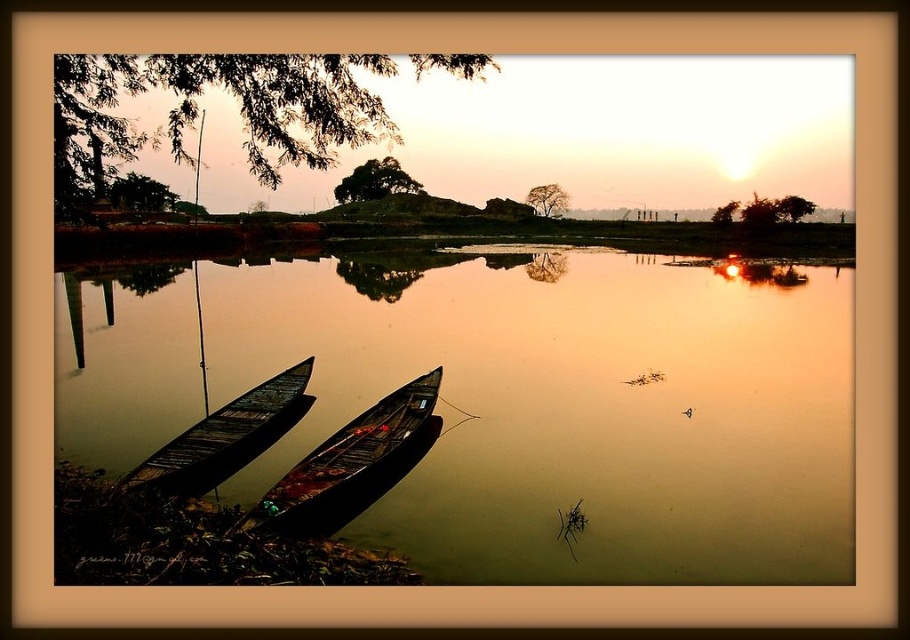
Looking at this image, you are an observer standing on the shore looking at the brown wooden river at center and the wooden canoe at center. Which object takes up more space in the image?

The brown wooden river at center takes up more space in the image as it is larger in size than the wooden canoe at center.

You are standing on the shore of the serene sunset scene and see the brown wooden river at center and the wooden canoe at center. Which object is taller?

The brown wooden river at center is taller than the wooden canoe at center.

You are standing at the shore looking at the wooden canoe at center. Based on its position, can you determine if it is closer to the water surface or the sky in the sunset scene?

The wooden canoe at center is located at point coordinates that place it closer to the water surface rather than the sky, as its position is lower in the image.